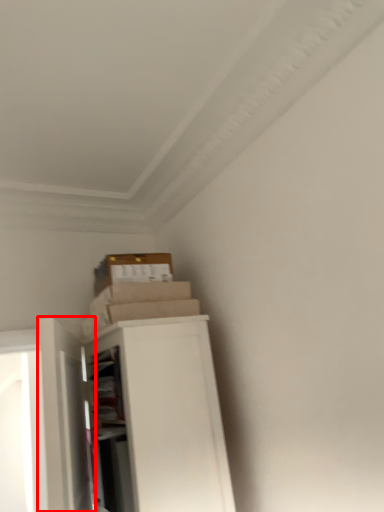
Question: From the image's perspective, where is door (annotated by the red box) located in relation to file cabinet in the image?

Choices:
 (A) below
 (B) above

Answer: (B)